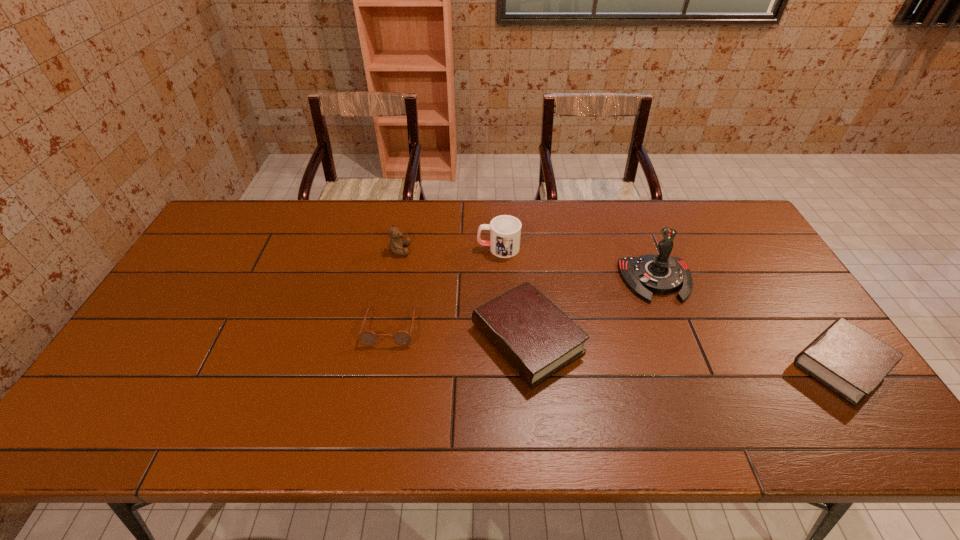
This screenshot has width=960, height=540. What are the coordinates of `object located at the near right corner` in the screenshot? It's located at (851, 362).

Where is `free space at the far edge`? This screenshot has width=960, height=540. free space at the far edge is located at coordinates (554, 241).

Locate an element on the screen. vacant area at the near edge is located at coordinates (222, 378).

In order to click on vacant area at the left edge in this screenshot , I will do `click(215, 285)`.

Find the location of a particular element. This screenshot has height=540, width=960. vacant region at the right edge of the desktop is located at coordinates (748, 244).

At what (x,y) coordinates should I click in order to perform the action: click on vacant area at the far left corner. Please return your answer as a coordinate pair (x, y). This screenshot has height=540, width=960. Looking at the image, I should click on (258, 219).

Find the location of a particular element. Image resolution: width=960 pixels, height=540 pixels. vacant space at the far right corner is located at coordinates (736, 228).

Where is `vacant point located between the tallest object and the taller Bible`? vacant point located between the tallest object and the taller Bible is located at coordinates (591, 309).

This screenshot has width=960, height=540. I want to click on free spot between the spectacles and the rightmost object, so [x=615, y=346].

You are a GUI agent. You are given a task and a screenshot of the screen. Output one action in this format:
    pyautogui.click(x=<x>, y=<y>)
    Task: Click on the vacant area between the fourth tallest object and the second object from right to left
    The height and width of the screenshot is (540, 960).
    Given the screenshot: What is the action you would take?
    pyautogui.click(x=591, y=309)